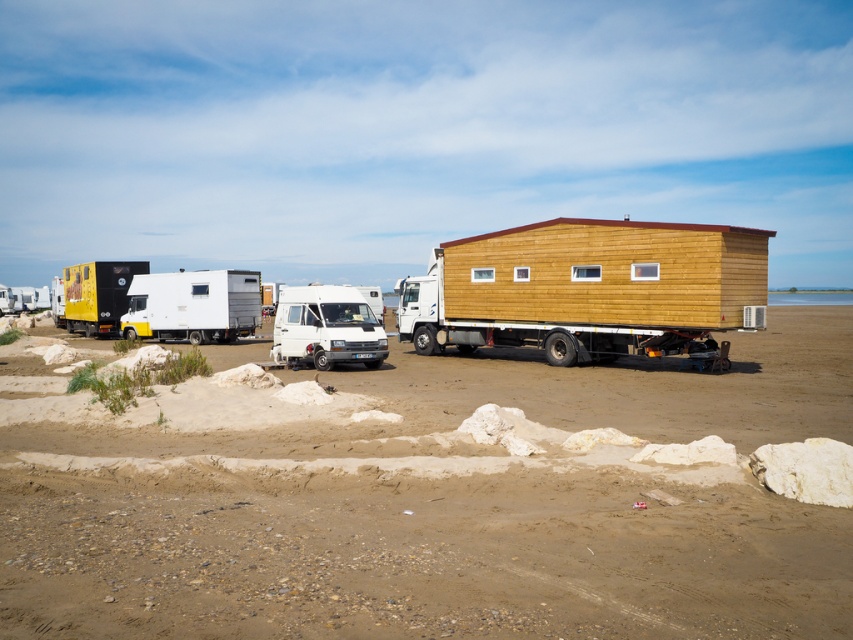
Is brown sandy dirt field at lower center closer to camera compared to yellow matte truck at left?

Yes, it is in front of yellow matte truck at left.

Does brown sandy dirt field at lower center appear on the right side of yellow matte truck at left?

Indeed, brown sandy dirt field at lower center is positioned on the right side of yellow matte truck at left.

This screenshot has width=853, height=640. Identify the location of brown sandy dirt field at lower center. (447, 512).

Is wooden cabin at center to the right of white matte van at center from the viewer's perspective?

Yes, wooden cabin at center is to the right of white matte van at center.

Looking at this image, does wooden cabin at center have a larger size compared to white matte van at center?

Correct, wooden cabin at center is larger in size than white matte van at center.

This screenshot has width=853, height=640. In order to click on wooden cabin at center in this screenshot , I will do `click(589, 289)`.

Which is behind, point (293, 332) or point (96, 314)?

Point (96, 314)

Is white matte van at center closer to the viewer compared to yellow matte truck at left?

Yes, white matte van at center is in front of yellow matte truck at left.

Where is `white matte van at center`? white matte van at center is located at coordinates (328, 326).